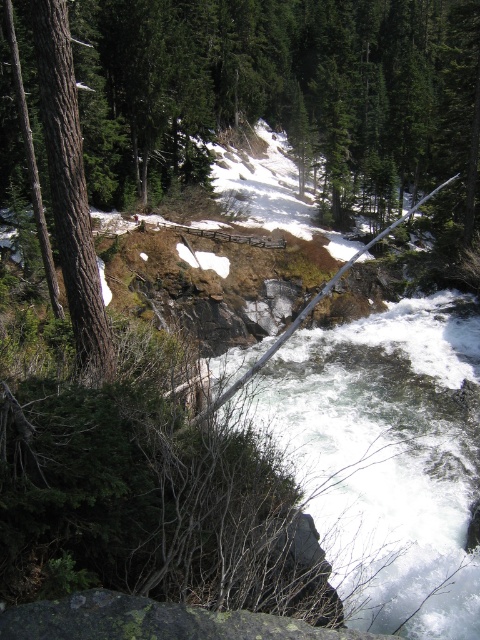
What do you see at coordinates (285, 97) in the screenshot?
I see `brown rough tree at center` at bounding box center [285, 97].

Who is more forward, (289, 131) or (296, 476)?

Point (296, 476) is more forward.

This screenshot has width=480, height=640. I want to click on brown rough tree at center, so click(285, 97).

Between point (455, 154) and point (264, 628), which one is positioned behind?

Positioned behind is point (455, 154).

Is the position of brown rough tree at center less distant than that of green mossy rock at lower center?

No, it is behind green mossy rock at lower center.

Find the location of a particular element. The height and width of the screenshot is (640, 480). brown rough tree at center is located at coordinates (285, 97).

At what (x,y) coordinates should I click in order to perform the action: click on brown rough tree at center. Please return your answer as a coordinate pair (x, y). Looking at the image, I should click on (285, 97).

How far apart are white frothy water at center and green mossy rock at lower center?

white frothy water at center and green mossy rock at lower center are 9.39 meters apart.

Identify the location of white frothy water at center. (388, 458).